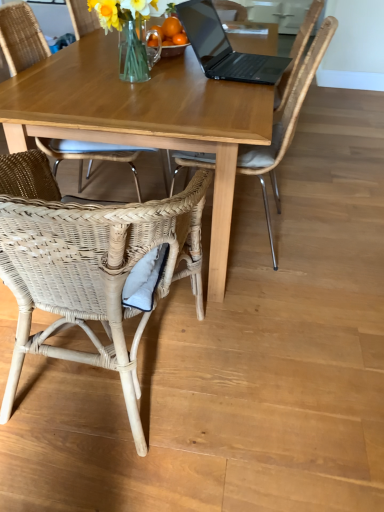
This screenshot has height=512, width=384. What are the coordinates of `vacant area that lies to the right of translucent glass vase at upper center` in the screenshot? It's located at (192, 84).